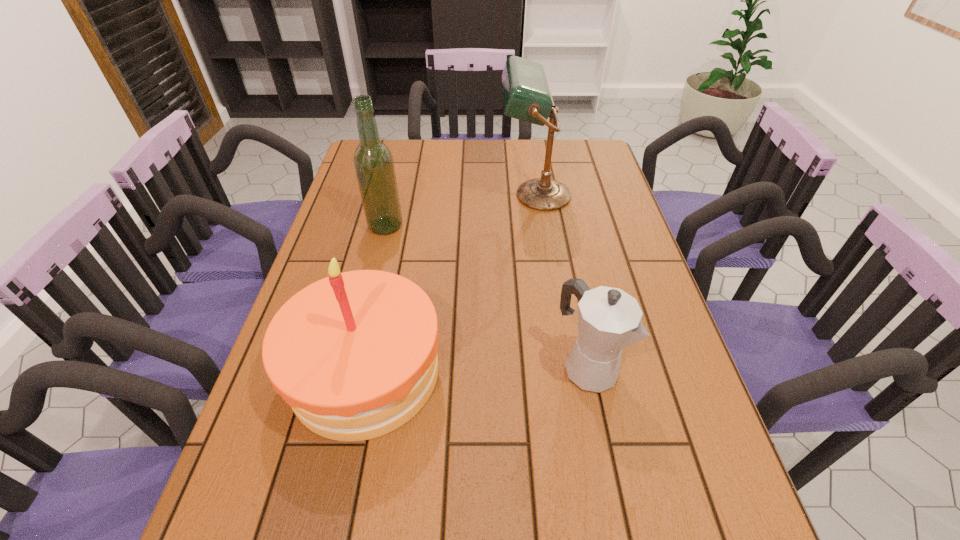
I want to click on vacant area that lies between the liquor and the table lamp, so click(460, 211).

Locate an element on the screen. This screenshot has height=540, width=960. free space between the table lamp and the coffeepot is located at coordinates (561, 281).

Identify the location of vacant area that lies between the third tallest object and the shortest object. This screenshot has width=960, height=540. (475, 369).

This screenshot has width=960, height=540. In order to click on free space between the table lamp and the liquor in this screenshot , I will do `click(460, 211)`.

Where is `free space between the table lamp and the birthday cake`? The height and width of the screenshot is (540, 960). free space between the table lamp and the birthday cake is located at coordinates (450, 284).

This screenshot has width=960, height=540. I want to click on free spot between the birthday cake and the table lamp, so 450,284.

In order to click on free space between the table lamp and the coffeepot in this screenshot , I will do `click(561, 281)`.

The width and height of the screenshot is (960, 540). What are the coordinates of `empty space between the liquor and the table lamp` in the screenshot? It's located at (460, 211).

Image resolution: width=960 pixels, height=540 pixels. Find the location of `free space between the shortest object and the table lamp`. free space between the shortest object and the table lamp is located at coordinates (561, 281).

The height and width of the screenshot is (540, 960). Find the location of `object that is the closest one to the coffeepot`. object that is the closest one to the coffeepot is located at coordinates (354, 354).